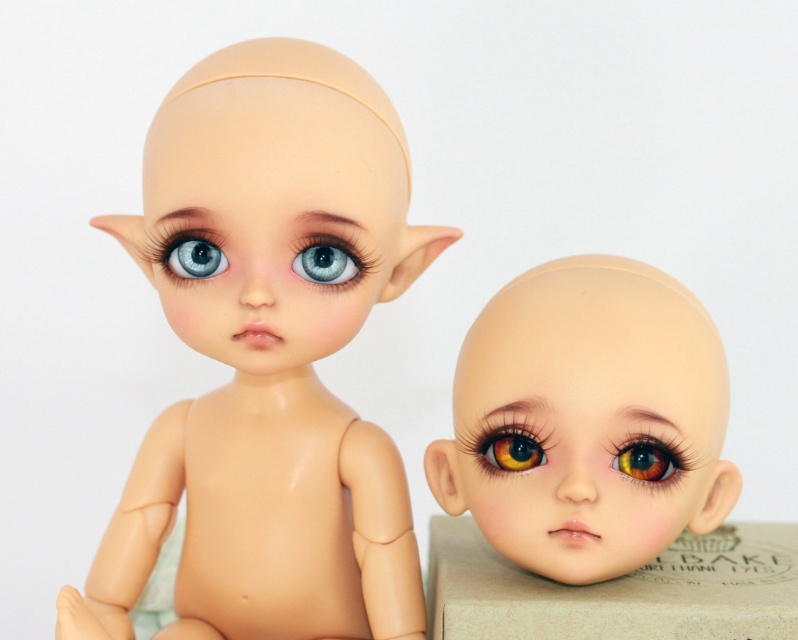
You are an artist trying to paint a scene that includes the matte beige head at center and the brown glossy eye at center. If you want to maintain the correct proportions between them, which object should you paint larger?

The matte beige head at center should be painted larger than the brown glossy eye at center because it is bigger than the brown glossy eye at center according to the description.

You are organizing a toy store shelf and need to place the beige cardboard box at lower center and the matte plastic eye at center. If you want to arrange them side by side horizontally, which object should be placed first to ensure they fit without overlapping?

The beige cardboard box at lower center might be wider than the matte plastic eye at center, so you should place the beige cardboard box at lower center first to accommodate its width.